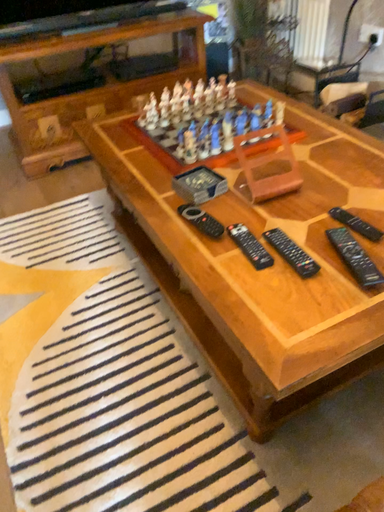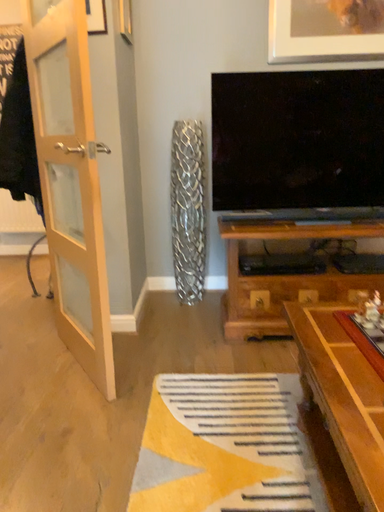
Question: Which way did the camera rotate in the video?

Choices:
 (A) rotated left
 (B) rotated right

Answer: (A)